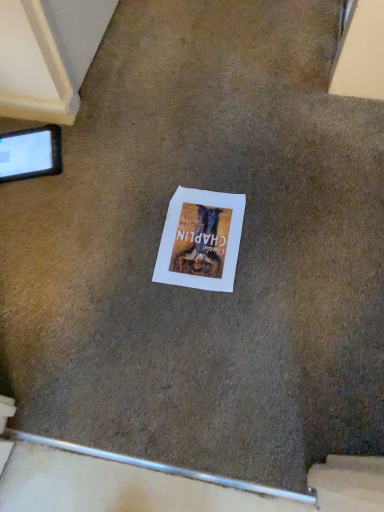
Where is `free space below white paper at center (from a real-world perspective)`? The height and width of the screenshot is (512, 384). free space below white paper at center (from a real-world perspective) is located at coordinates (195, 241).